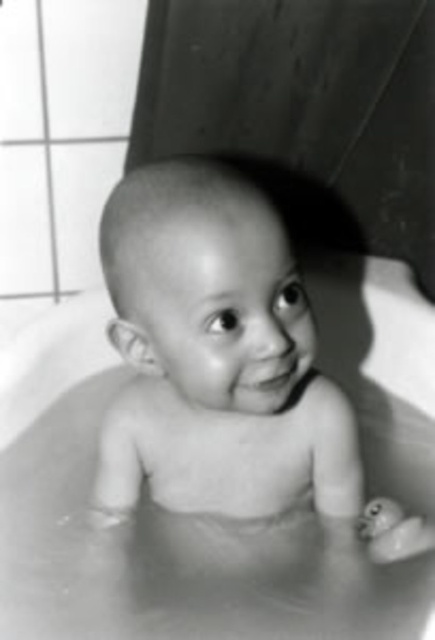
Measure the distance between smooth rubber bath at center and smooth skin baby at center.

A distance of 9.21 inches exists between smooth rubber bath at center and smooth skin baby at center.

Is point (321, 259) positioned before point (227, 499)?

No.

What are the coordinates of `smooth rubber bath at center` in the screenshot? It's located at (143, 525).

Where is `smooth rubber bath at center`? smooth rubber bath at center is located at coordinates (143, 525).